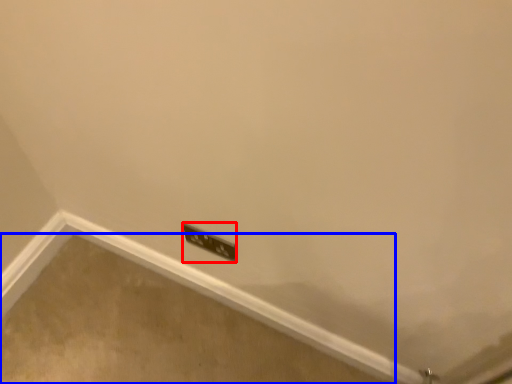
Question: Among these objects, which one is farthest to the camera, power plugs and sockets (highlighted by a red box) or concrete (highlighted by a blue box)?

Choices:
 (A) power plugs and sockets
 (B) concrete

Answer: (B)